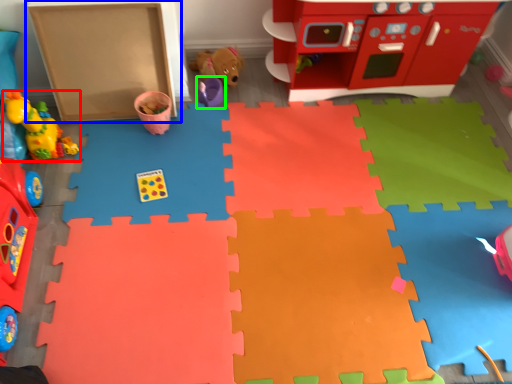
Question: Which object is the closest to the toy (highlighted by a red box)? Choose among these: cardboard box (highlighted by a blue box) or toy (highlighted by a green box).

Choices:
 (A) cardboard box
 (B) toy

Answer: (A)